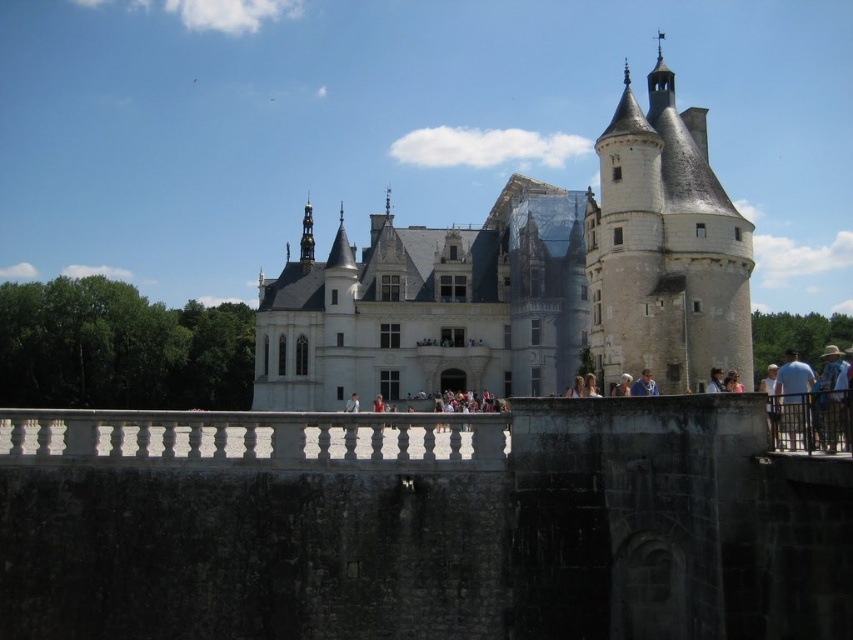
Question: Based on their relative distances, which object is nearer to the blonde hair at center?

Choices:
 (A) matte blue shirt at center
 (B) light brown wooden hat at center

Answer: (B)

Question: Which of the following is the farthest from the observer?

Choices:
 (A) white cotton shirt at upper center
 (B) white fabric hat at upper center
 (C) blonde hair at center

Answer: (B)

Question: Considering the real-world distances, which object is closest to the white fabric shirt at center?

Choices:
 (A) white fabric hat at upper center
 (B) matte blue shirt at center

Answer: (B)

Question: Does blue shirt at upper right come behind matte blue shirt at center?

Choices:
 (A) yes
 (B) no

Answer: (B)

Question: Can you confirm if blue shirt at upper right is positioned to the left of blonde hair at center?

Choices:
 (A) no
 (B) yes

Answer: (A)

Question: Can you confirm if white stone railing at center is positioned to the left of white fabric hat at upper center?

Choices:
 (A) no
 (B) yes

Answer: (B)